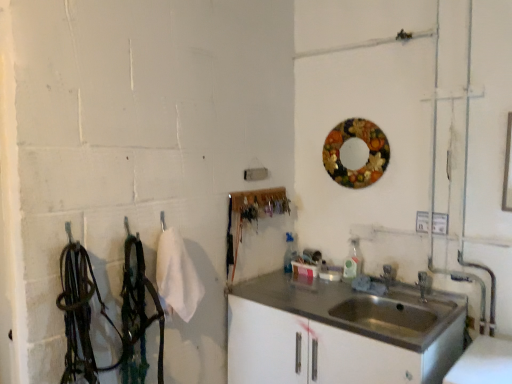
Question: From the image's perspective, would you say wooden circular mirror at upper right is positioned over satin silver faucet at sink right?

Choices:
 (A) no
 (B) yes

Answer: (B)

Question: Does wooden circular mirror at upper right come in front of satin silver faucet at sink right?

Choices:
 (A) no
 (B) yes

Answer: (B)

Question: Would you say satin silver faucet at sink right is part of wooden circular mirror at upper right's contents?

Choices:
 (A) no
 (B) yes

Answer: (A)

Question: Is wooden circular mirror at upper right looking in the opposite direction of satin silver faucet at sink right?

Choices:
 (A) yes
 (B) no

Answer: (B)

Question: Could you tell me if wooden circular mirror at upper right is facing satin silver faucet at sink right?

Choices:
 (A) yes
 (B) no

Answer: (B)

Question: Does wooden circular mirror at upper right appear on the left side of satin silver faucet at sink right?

Choices:
 (A) no
 (B) yes

Answer: (B)

Question: Is satin silver faucet at sink right outside wooden circular mirror at upper right?

Choices:
 (A) yes
 (B) no

Answer: (A)

Question: Is satin silver faucet at sink right shorter than wooden circular mirror at upper right?

Choices:
 (A) yes
 (B) no

Answer: (A)

Question: Considering the relative positions of satin silver faucet at sink right and wooden circular mirror at upper right in the image provided, is satin silver faucet at sink right to the right of wooden circular mirror at upper right from the viewer's perspective?

Choices:
 (A) no
 (B) yes

Answer: (B)

Question: From the image's perspective, does satin silver faucet at sink right appear higher than wooden circular mirror at upper right?

Choices:
 (A) no
 (B) yes

Answer: (A)

Question: Can you confirm if satin silver faucet at sink right is thinner than wooden circular mirror at upper right?

Choices:
 (A) yes
 (B) no

Answer: (B)

Question: Considering the relative sizes of satin silver faucet at sink right and wooden circular mirror at upper right in the image provided, is satin silver faucet at sink right taller than wooden circular mirror at upper right?

Choices:
 (A) no
 (B) yes

Answer: (A)

Question: From the image's perspective, is satin white cabinet at lower right beneath satin silver faucet at sink right?

Choices:
 (A) no
 (B) yes

Answer: (B)